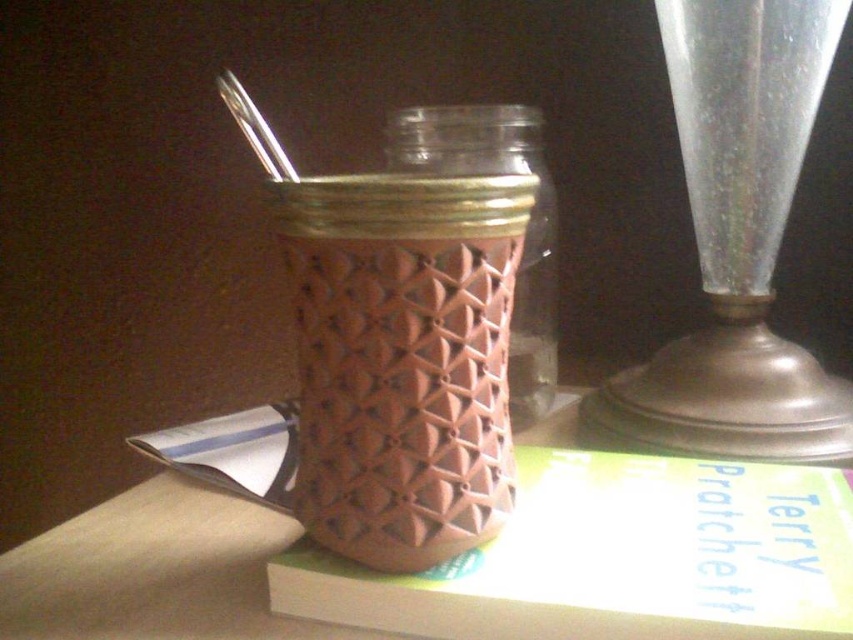
Question: Which of the following is the closest to the observer?

Choices:
 (A) pink textured glass jar at center
 (B) transparent glass vase at right

Answer: (A)

Question: Is transparent glass vase at right wider than pink textured glass jar at center?

Choices:
 (A) no
 (B) yes

Answer: (B)

Question: Which point appears farthest from the camera in this image?

Choices:
 (A) (654, 435)
 (B) (431, 109)

Answer: (B)

Question: Can you confirm if transparent glass vase at right is bigger than pink textured glass jar at center?

Choices:
 (A) yes
 (B) no

Answer: (B)

Question: Which of these objects is positioned farthest from the transparent glass vase at right?

Choices:
 (A) brown textured vase at center
 (B) pink textured glass jar at center

Answer: (A)

Question: Is brown textured vase at center positioned at the back of pink textured glass jar at center?

Choices:
 (A) no
 (B) yes

Answer: (A)